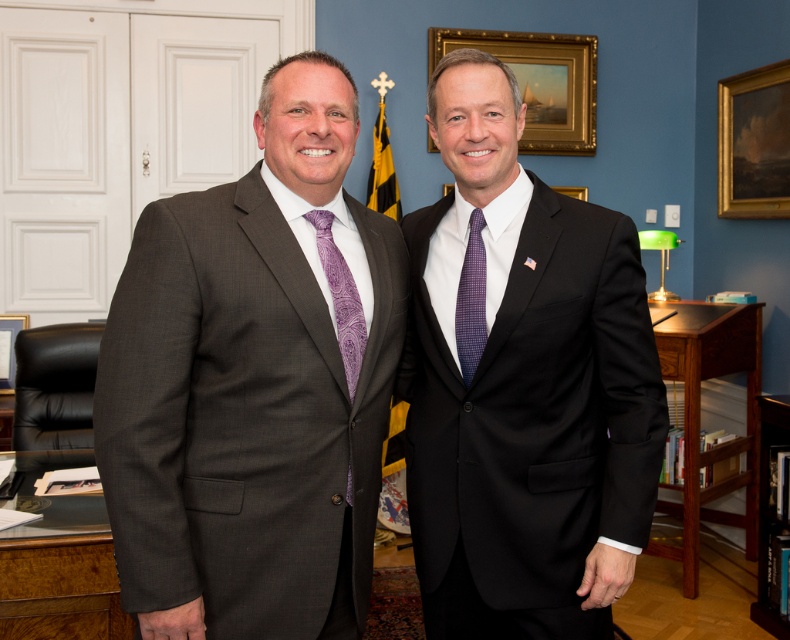
You are standing in an office and see the matte gray suit at left and the brushed metal picture frame at left. Which object is nearer to you?

The matte gray suit at left is closer to the viewer than the brushed metal picture frame at left.

You are a photographer setting up for a group photo. You notice the matte black suit at right and the brushed metal picture frame at left in the scene. Which object is closer to the camera, based on their positions?

The matte black suit at right is closer to the camera because it is in front of the brushed metal picture frame at left.

You are standing in front of the office scene. There are two points marked in the image. The first point is at coordinates point (693, 536) and the second at point (578, 141). Which of these points is closer to you?

Point (693, 536) is closer to the viewer than point (578, 141).